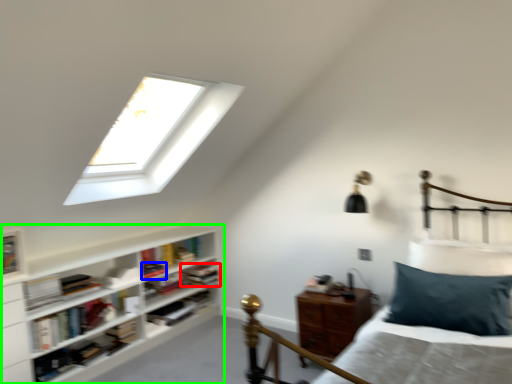
Question: Based on their relative distances, which object is nearer to book (highlighted by a red box)? Choose from book (highlighted by a blue box) and shelf (highlighted by a green box).

Choices:
 (A) book
 (B) shelf

Answer: (A)